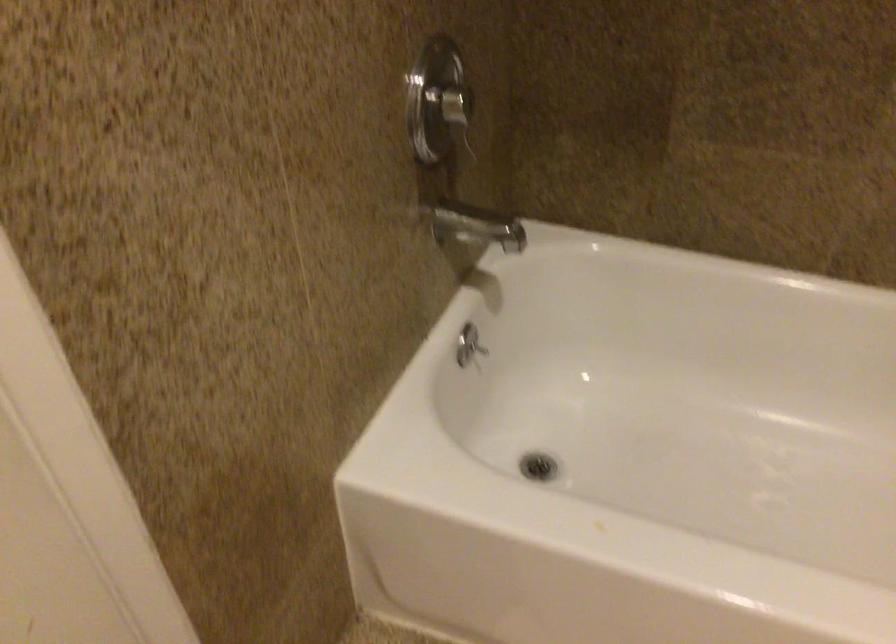
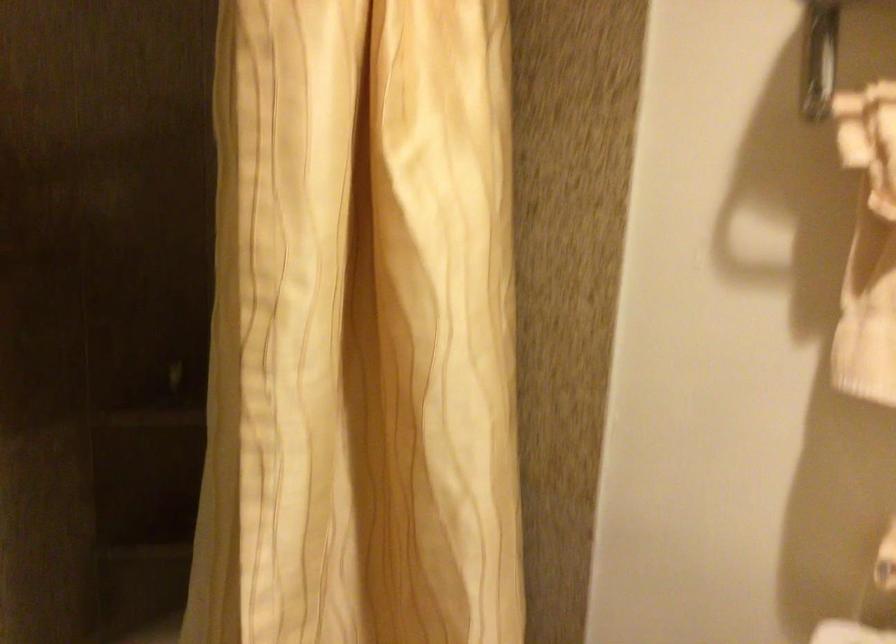
Question: How did the camera likely rotate?

Choices:
 (A) Left
 (B) Right
 (C) Up
 (D) Down

Answer: (B)